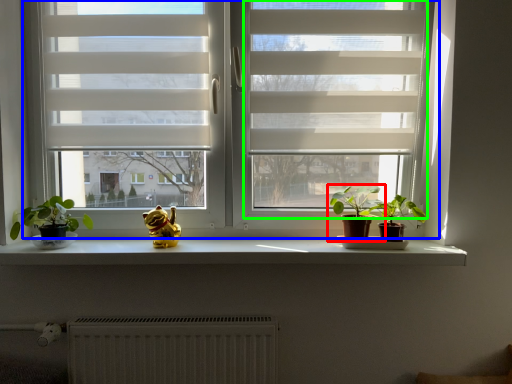
Question: Based on their relative distances, which object is nearer to houseplant (highlighted by a red box)? Choose from window (highlighted by a blue box) and screen door (highlighted by a green box).

Choices:
 (A) window
 (B) screen door

Answer: (B)